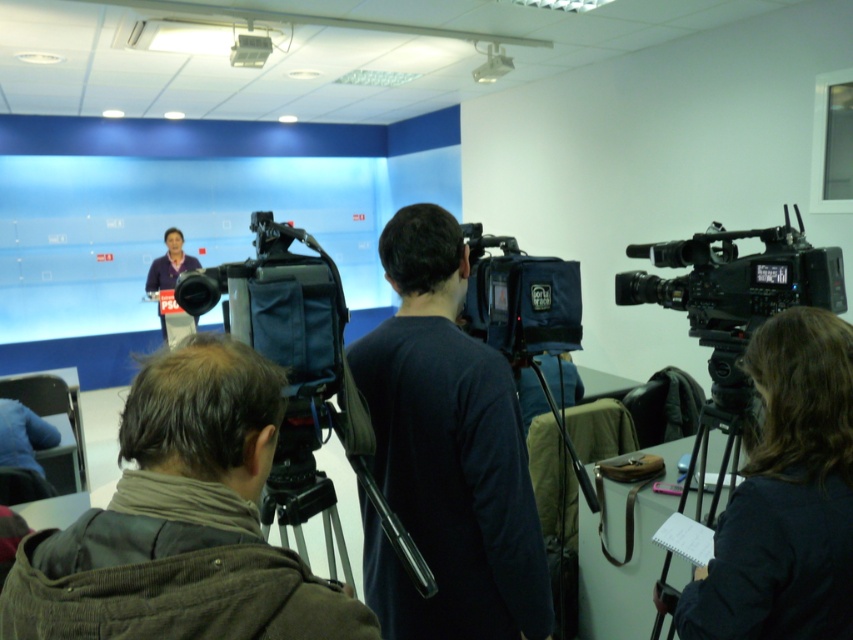
Does dark blue fabric at lower right have a larger size compared to black matte camera at center?

Correct, dark blue fabric at lower right is larger in size than black matte camera at center.

Can you confirm if dark blue fabric at lower right is smaller than black matte camera at center?

Incorrect, dark blue fabric at lower right is not smaller in size than black matte camera at center.

Identify the location of dark blue fabric at lower right. (786, 497).

Does black plastic camera at right have a lesser width compared to matte purple shirt at center?

Correct, black plastic camera at right's width is less than matte purple shirt at center's.

This screenshot has width=853, height=640. Describe the element at coordinates (735, 280) in the screenshot. I see `black plastic camera at right` at that location.

Where is `black plastic camera at right`? This screenshot has width=853, height=640. black plastic camera at right is located at coordinates (735, 280).

Does black matte video camera at center have a greater width compared to black plastic camera at right?

Indeed, black matte video camera at center has a greater width compared to black plastic camera at right.

Is point (364, 433) more distant than point (820, 252)?

No, (364, 433) is closer to viewer.

You are a GUI agent. You are given a task and a screenshot of the screen. Output one action in this format:
    pyautogui.click(x=<x>, y=<y>)
    Task: Click on the black matte video camera at center
    
    Given the screenshot: What is the action you would take?
    pyautogui.click(x=302, y=380)